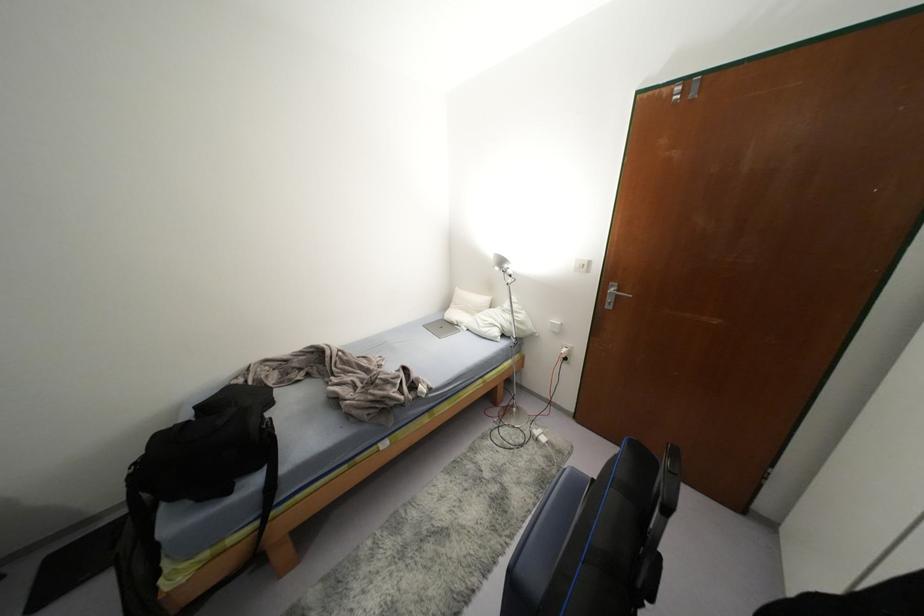
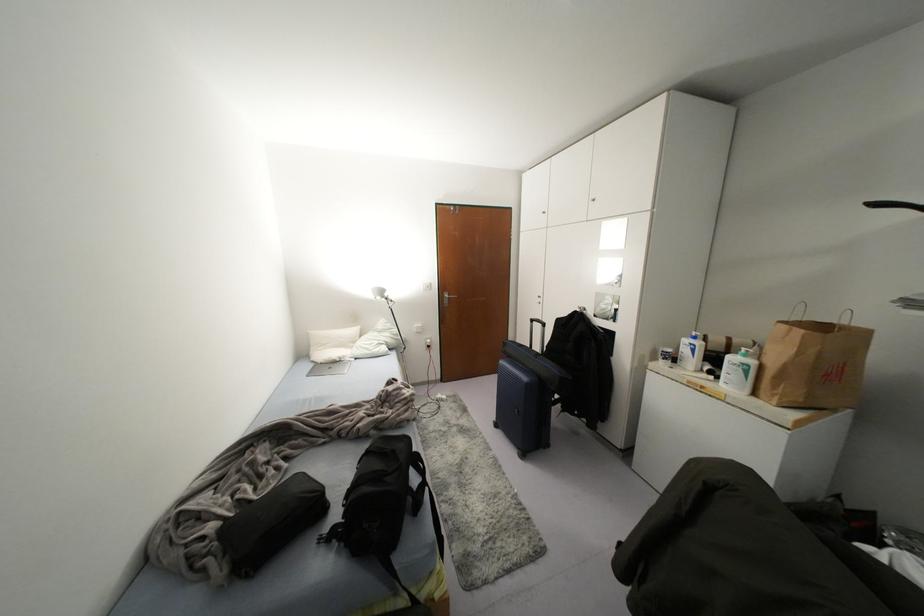
Locate, in the second image, the point that corresponds to (612,289) in the first image.

(445, 296)